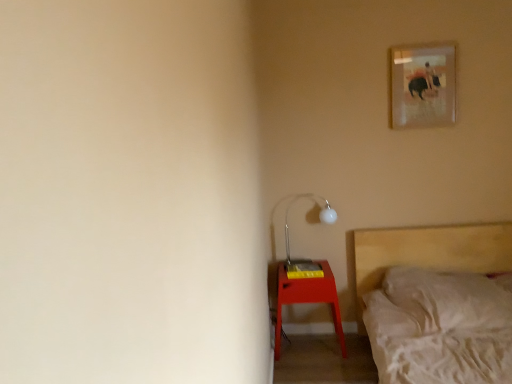
Image resolution: width=512 pixels, height=384 pixels. What are the coordinates of `wooden bed at lower right` in the screenshot? It's located at (430, 250).

What do you see at coordinates (289, 242) in the screenshot? The image size is (512, 384). I see `matte white metal table lamp at lower right` at bounding box center [289, 242].

In order to face matte red nightstand at lower right, should I rotate leftwards or rightwards?

You should look right and rotate roughly 6.695 degrees.

You are a GUI agent. You are given a task and a screenshot of the screen. Output one action in this format:
    pyautogui.click(x=<x>, y=<y>)
    Task: Click on the matte glass picture frame at upper right
    The image size is (512, 384).
    Given the screenshot: What is the action you would take?
    pyautogui.click(x=423, y=85)

Is matte red nightstand at lower right at the left side of matte white metal table lamp at lower right?

Indeed, matte red nightstand at lower right is positioned on the left side of matte white metal table lamp at lower right.

Is matte white metal table lamp at lower right inside matte red nightstand at lower right?

No, matte white metal table lamp at lower right is not inside matte red nightstand at lower right.

At what (x,y) coordinates should I click in order to perform the action: click on table lamp below the matte glass picture frame at upper right (from a real-world perspective). Please return your answer as a coordinate pair (x, y). Image resolution: width=512 pixels, height=384 pixels. Looking at the image, I should click on (289, 242).

Could you measure the distance between matte white metal table lamp at lower right and matte glass picture frame at upper right?

matte white metal table lamp at lower right and matte glass picture frame at upper right are 39.17 inches apart.

Does matte white metal table lamp at lower right have a larger size compared to matte glass picture frame at upper right?

Yes, matte white metal table lamp at lower right is bigger than matte glass picture frame at upper right.

Between matte white metal table lamp at lower right and matte glass picture frame at upper right, which one has more height?

matte glass picture frame at upper right.

Measure the distance between wooden bed at lower right and matte white metal table lamp at lower right.

24.25 inches.

From the picture: Is matte white metal table lamp at lower right surrounded by wooden bed at lower right?

No, matte white metal table lamp at lower right is located outside of wooden bed at lower right.

From the image's perspective, which one is positioned lower, wooden bed at lower right or matte white metal table lamp at lower right?

From the image's view, wooden bed at lower right is below.

Looking at this image, can you tell me how much wooden bed at lower right and matte white metal table lamp at lower right differ in facing direction?

The angle between the facing direction of wooden bed at lower right and the facing direction of matte white metal table lamp at lower right is 0.394 degrees.

Consider the image. From the image's perspective, is matte white metal table lamp at lower right on top of wooden bed at lower right?

Yes.

Between matte white metal table lamp at lower right and wooden bed at lower right, which one has smaller size?

Smaller between the two is matte white metal table lamp at lower right.

Is matte glass picture frame at upper right spatially inside matte white metal table lamp at lower right, or outside of it?

matte glass picture frame at upper right lies outside matte white metal table lamp at lower right.

Locate an element on the screen. table lamp located below the matte glass picture frame at upper right (from the image's perspective) is located at coordinates (289, 242).

From the image's perspective, would you say matte glass picture frame at upper right is shown under matte white metal table lamp at lower right?

No, from the image's perspective, matte glass picture frame at upper right is not below matte white metal table lamp at lower right.

Which object is more forward, matte white metal table lamp at lower right or matte red nightstand at lower right?

Positioned in front is matte red nightstand at lower right.

Is matte red nightstand at lower right a part of matte white metal table lamp at lower right?

No, matte red nightstand at lower right is not a part of matte white metal table lamp at lower right.

From the image's perspective, is matte white metal table lamp at lower right above or below matte red nightstand at lower right?

matte white metal table lamp at lower right is situated higher than matte red nightstand at lower right in the image.

Consider the image. Which object is positioned more to the right, matte white metal table lamp at lower right or matte red nightstand at lower right?

matte white metal table lamp at lower right is more to the right.

Can you tell me how much matte red nightstand at lower right and matte glass picture frame at upper right differ in facing direction?

1.85 degrees separate the facing orientations of matte red nightstand at lower right and matte glass picture frame at upper right.

From a real-world perspective, between matte red nightstand at lower right and matte glass picture frame at upper right, who is vertically lower?

In real-world perspective, matte red nightstand at lower right is lower.

You are a GUI agent. You are given a task and a screenshot of the screen. Output one action in this format:
    pyautogui.click(x=<x>, y=<y>)
    Task: Click on the nightstand on the left of matte glass picture frame at upper right
    
    Given the screenshot: What is the action you would take?
    pyautogui.click(x=308, y=299)

Where is `nightstand below the matte white metal table lamp at lower right (from a real-world perspective)`? Image resolution: width=512 pixels, height=384 pixels. nightstand below the matte white metal table lamp at lower right (from a real-world perspective) is located at coordinates (308, 299).

Identify the location of picture frame in front of the matte white metal table lamp at lower right. (423, 85).

Which object lies further to the anchor point matte glass picture frame at upper right, matte red nightstand at lower right or matte white metal table lamp at lower right?

matte red nightstand at lower right is positioned further to the anchor matte glass picture frame at upper right.

Considering their positions, is matte glass picture frame at upper right positioned further to matte white metal table lamp at lower right than wooden bed at lower right?

The object further to matte white metal table lamp at lower right is matte glass picture frame at upper right.

Based on their spatial positions, is matte white metal table lamp at lower right or wooden bed at lower right closer to matte red nightstand at lower right?

Among the two, matte white metal table lamp at lower right is located nearer to matte red nightstand at lower right.

From the image, which object appears to be nearer to matte white metal table lamp at lower right, matte red nightstand at lower right or matte glass picture frame at upper right?

matte red nightstand at lower right is closer to matte white metal table lamp at lower right.

Based on their spatial positions, is matte white metal table lamp at lower right or matte glass picture frame at upper right further from matte red nightstand at lower right?

matte glass picture frame at upper right is further to matte red nightstand at lower right.

When comparing their distances from matte glass picture frame at upper right, does matte red nightstand at lower right or wooden bed at lower right seem closer?

wooden bed at lower right is positioned closer to the anchor matte glass picture frame at upper right.

Based on their spatial positions, is wooden bed at lower right or matte red nightstand at lower right further from matte white metal table lamp at lower right?

Based on the image, wooden bed at lower right appears to be further to matte white metal table lamp at lower right.

Looking at the image, which one is located closer to wooden bed at lower right, matte red nightstand at lower right or matte white metal table lamp at lower right?

matte red nightstand at lower right is positioned closer to the anchor wooden bed at lower right.

Image resolution: width=512 pixels, height=384 pixels. I want to click on table lamp between matte glass picture frame at upper right and matte red nightstand at lower right in the up-down direction, so click(x=289, y=242).

The image size is (512, 384). In order to click on nightstand between wooden bed at lower right and matte glass picture frame at upper right from front to back in this screenshot , I will do `click(308, 299)`.

The width and height of the screenshot is (512, 384). Find the location of `nightstand between wooden bed at lower right and matte white metal table lamp at lower right along the z-axis`. nightstand between wooden bed at lower right and matte white metal table lamp at lower right along the z-axis is located at coordinates (308, 299).

What are the coordinates of `picture frame between wooden bed at lower right and matte white metal table lamp at lower right in the front-back direction` in the screenshot? It's located at (423, 85).